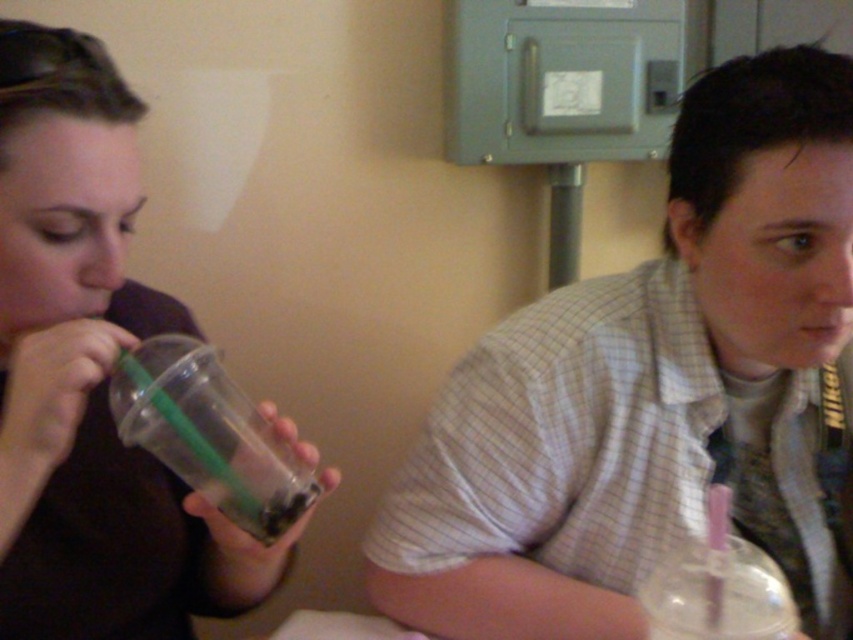
Question: Can you confirm if matte plastic cup at right is positioned to the left of clear plastic cup at left?

Choices:
 (A) no
 (B) yes

Answer: (A)

Question: Which object appears closest to the camera in this image?

Choices:
 (A) transparent plastic cup at left
 (B) clear plastic cup at left

Answer: (A)

Question: From the image, what is the correct spatial relationship of clear plastic cup at left in relation to clear plastic cup at lower right?

Choices:
 (A) left
 (B) right

Answer: (A)

Question: Is clear plastic cup at left closer to camera compared to clear plastic cup at lower right?

Choices:
 (A) yes
 (B) no

Answer: (B)

Question: Based on their relative distances, which object is farther from the transparent plastic cup at left?

Choices:
 (A) clear plastic cup at lower right
 (B) clear plastic cup at left
 (C) matte plastic cup at right

Answer: (A)

Question: Which object is closer to the camera taking this photo?

Choices:
 (A) clear plastic cup at left
 (B) transparent plastic cup at left
 (C) matte plastic cup at right
 (D) clear plastic cup at lower right

Answer: (D)